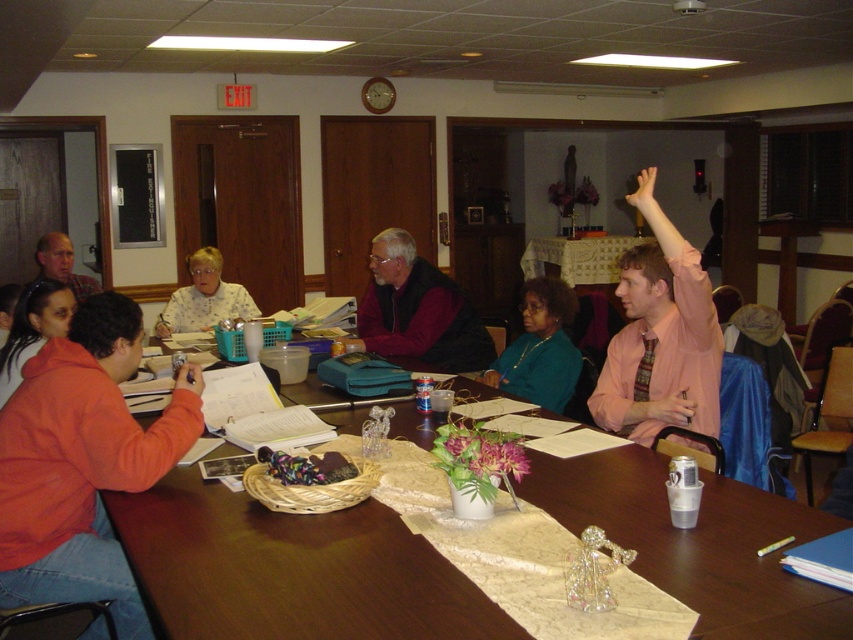
Question: Does maroon sweater at center have a larger size compared to white lace tablecloth at center?

Choices:
 (A) no
 (B) yes

Answer: (A)

Question: Does teal fabric jacket at center appear over light blue floral blouse at center?

Choices:
 (A) no
 (B) yes

Answer: (A)

Question: Which of the following is the farthest from the observer?

Choices:
 (A) (38, 241)
 (B) (648, 173)

Answer: (A)

Question: Which point appears closest to the camera in this image?

Choices:
 (A) (73, 257)
 (B) (572, 380)

Answer: (B)

Question: Based on their relative distances, which object is nearer to the brightly colored fabric at center?

Choices:
 (A) maroon sweater at center
 (B) light blue floral blouse at center

Answer: (A)

Question: Can you confirm if wooden table at center is positioned to the right of orange hoodie at lower left?

Choices:
 (A) no
 (B) yes

Answer: (B)